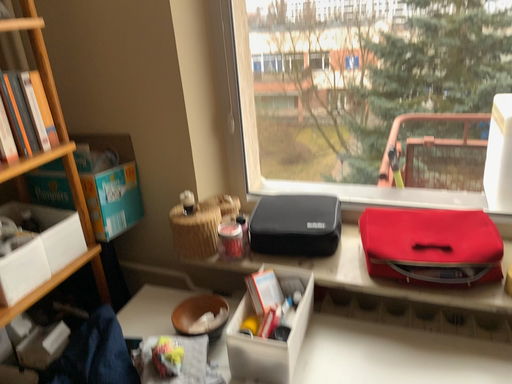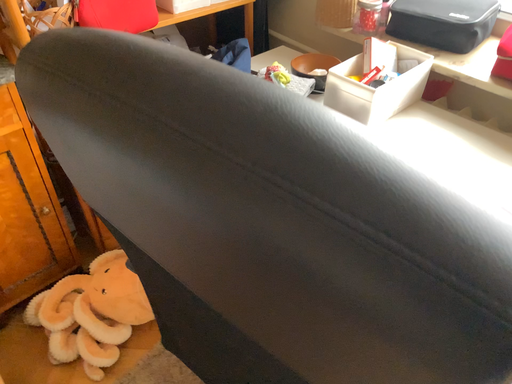
Question: Which way did the camera rotate in the video?

Choices:
 (A) rotated upward
 (B) rotated downward

Answer: (B)